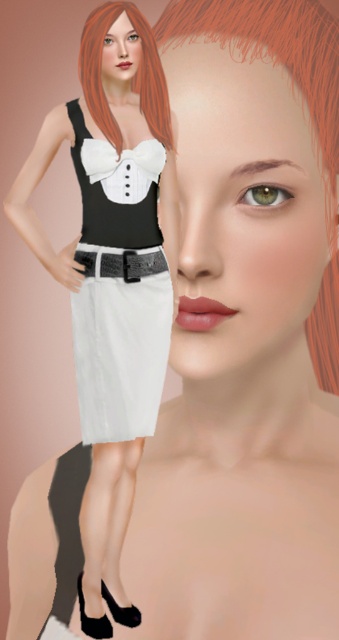
You are an artist trying to sketch the character based on the image. You want to place the point at coordinate point [131,80] on the correct part of the character. Where should you place it?

The point [131,80] is on the blonde hair at upper left, so you should place it there.

You are an artist trying to draw the character based on the image. To ensure accuracy, you need to know the exact location of the blonde hair at upper left. Can you determine its position in the coordinate system where the bottom left corner is the origin?

The position of the blonde hair at upper left is at point (131, 80) in the coordinate system where the bottom left corner is the origin.

You are a fashion designer trying to adjust the proportions of the outfit in the image. The character is wearing a white matte skirt at center and a black leather belt at center. Which of these two items has a greater height?

The white matte skirt at center has a greater height compared to the black leather belt at center.